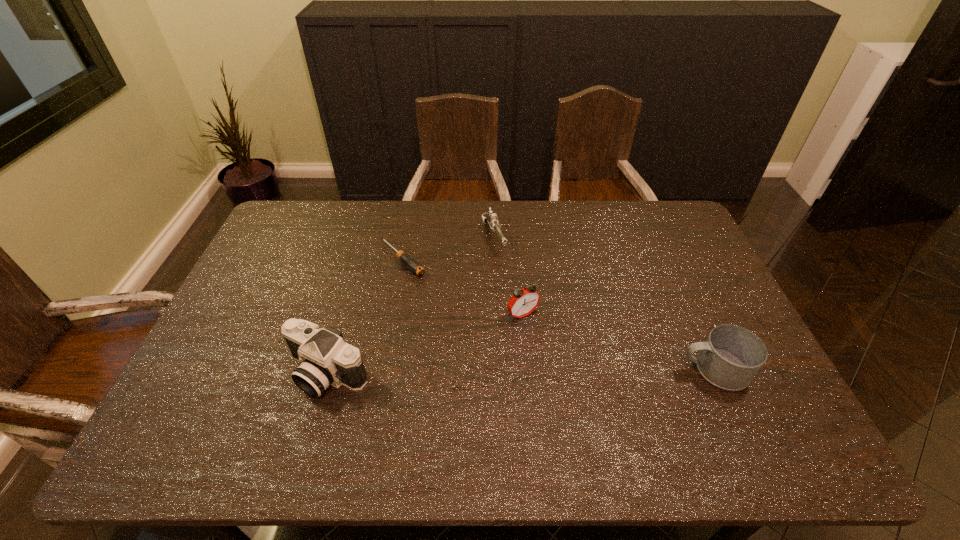
Identify the location of mug at the near edge. (731, 356).

Where is `object that is at the right edge`? The image size is (960, 540). object that is at the right edge is located at coordinates (731, 356).

Locate an element on the screen. The height and width of the screenshot is (540, 960). object that is at the near right corner is located at coordinates [731, 356].

In the image, there is a desktop. In order to click on vacant space at the far edge in this screenshot , I will do `click(536, 229)`.

This screenshot has height=540, width=960. Find the location of `vacant region at the near edge of the desktop`. vacant region at the near edge of the desktop is located at coordinates (518, 411).

Image resolution: width=960 pixels, height=540 pixels. In order to click on blank space at the left edge of the desktop in this screenshot , I will do `click(218, 372)`.

The image size is (960, 540). What are the coordinates of `vacant space at the right edge of the desktop` in the screenshot? It's located at (701, 276).

The height and width of the screenshot is (540, 960). Find the location of `blank space at the far left corner of the desktop`. blank space at the far left corner of the desktop is located at coordinates (317, 210).

This screenshot has height=540, width=960. Find the location of `free spot at the far right corner of the desktop`. free spot at the far right corner of the desktop is located at coordinates (682, 233).

Image resolution: width=960 pixels, height=540 pixels. What are the coordinates of `free space between the gun and the mug` in the screenshot? It's located at (x=604, y=303).